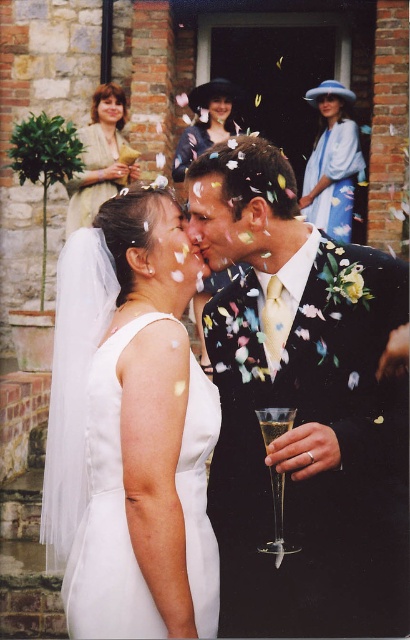
Question: Among these points, which one is nearest to the camera?

Choices:
 (A) (271, 493)
 (B) (66, 476)

Answer: (A)

Question: Is blue silk dress at upper center to the right of matte beige dress at upper left from the viewer's perspective?

Choices:
 (A) yes
 (B) no

Answer: (A)

Question: Which of the following is the farthest from the observer?

Choices:
 (A) matte black hat at upper center
 (B) clear glass wine glass at center

Answer: (A)

Question: Which of these objects is positioned farthest from the matte beige dress at upper left?

Choices:
 (A) white satin dress at center
 (B) clear glass wine glass at center

Answer: (B)

Question: Is white satin dress at center above clear glass wine glass at center?

Choices:
 (A) no
 (B) yes

Answer: (B)

Question: Does floral-patterned suit at center have a larger size compared to clear glass wine glass at center?

Choices:
 (A) no
 (B) yes

Answer: (B)